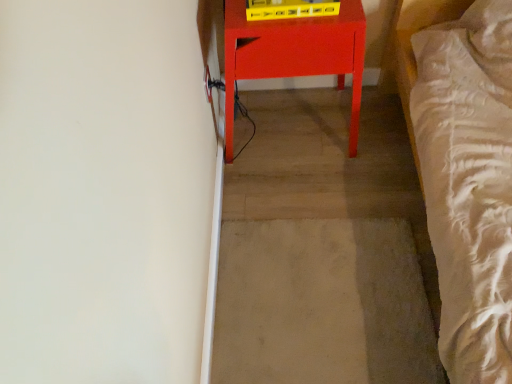
This screenshot has height=384, width=512. What do you see at coordinates (294, 54) in the screenshot? I see `matte red table at center` at bounding box center [294, 54].

What is the approximate height of matte red table at center?

The height of matte red table at center is 21.18 inches.

The height and width of the screenshot is (384, 512). I want to click on matte red table at center, so pos(294,54).

Locate an element on the screen. This screenshot has width=512, height=384. beige carpet at center is located at coordinates (322, 305).

Measure the distance between beige carpet at center and camera.

The depth of beige carpet at center is 3.62 feet.

This screenshot has width=512, height=384. Describe the element at coordinates (322, 305) in the screenshot. I see `beige carpet at center` at that location.

Where is `matte red table at center`? This screenshot has width=512, height=384. matte red table at center is located at coordinates (294, 54).

Is matte red table at center to the right of beige carpet at center from the viewer's perspective?

Incorrect, matte red table at center is not on the right side of beige carpet at center.

Relative to beige carpet at center, is matte red table at center in front or behind?

In the image, matte red table at center appears in front of beige carpet at center.

Which point is more forward, (244, 10) or (269, 298)?

Positioned in front is point (244, 10).

From the image's perspective, between matte red table at center and beige carpet at center, who is located below?

beige carpet at center is shown below in the image.

From a real-world perspective, is matte red table at center positioned above or below beige carpet at center?

matte red table at center is situated higher than beige carpet at center in the real world.

Can you confirm if matte red table at center is wider than beige carpet at center?

No, matte red table at center is not wider than beige carpet at center.

Who is shorter, matte red table at center or beige carpet at center?

With less height is beige carpet at center.

Which of these two, matte red table at center or beige carpet at center, is smaller?

beige carpet at center.

Is beige carpet at center completely or partially inside matte red table at center?

No, beige carpet at center is located outside of matte red table at center.

Is matte red table at center not close to beige carpet at center?

No, matte red table at center is not far away from beige carpet at center.

From the picture: Is matte red table at center oriented towards beige carpet at center?

Yes, matte red table at center faces towards beige carpet at center.

The width and height of the screenshot is (512, 384). Identify the location of concrete below the matte red table at center (from the image's perspective). point(322,305).

Which is more to the right, beige carpet at center or matte red table at center?

From the viewer's perspective, beige carpet at center appears more on the right side.

Is beige carpet at center closer to the viewer compared to matte red table at center?

That is False.

Does point (402, 282) come closer to viewer compared to point (345, 65)?

That is False.

From the image's perspective, is beige carpet at center above matte red table at center?

No, from the image's perspective, beige carpet at center is not over matte red table at center.

From a real-world perspective, which is physically below, beige carpet at center or matte red table at center?

From a 3D spatial view, beige carpet at center is below.

From the picture: In terms of width, does beige carpet at center look wider or thinner when compared to matte red table at center?

beige carpet at center is wider than matte red table at center.

Does beige carpet at center have a lesser height compared to matte red table at center?

Correct, beige carpet at center is not as tall as matte red table at center.

Can you confirm if beige carpet at center is bigger than matte red table at center?

No, beige carpet at center is not bigger than matte red table at center.

Would you say beige carpet at center is inside or outside matte red table at center?

beige carpet at center is not inside matte red table at center, it's outside.

Are beige carpet at center and matte red table at center making contact?

No, beige carpet at center is not beside matte red table at center.

Is beige carpet at center positioned with its back to matte red table at center?

No, beige carpet at center is not facing the opposite direction of matte red table at center.

Identify the location of furniture located in front of the beige carpet at center. (294, 54).

At what (x,y) coordinates should I click in order to perform the action: click on concrete that is below the matte red table at center (from the image's perspective). Please return your answer as a coordinate pair (x, y). Looking at the image, I should click on (322, 305).

This screenshot has height=384, width=512. I want to click on furniture above the beige carpet at center (from a real-world perspective), so click(294, 54).